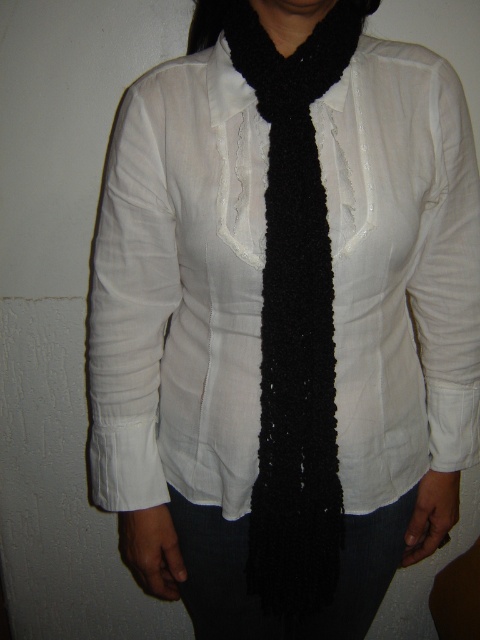
Is black knitted scarf at center closer to the viewer compared to black fuzzy scarf at center?

No.

Can you confirm if black knitted scarf at center is shorter than black fuzzy scarf at center?

No.

Between point (324, 372) and point (250, 0), which one is positioned behind?

The point (250, 0) is behind.

Identify the location of black knitted scarf at center. (x=295, y=317).

Is white cotton blouse at center thinner than black knitted scarf at center?

Incorrect, white cotton blouse at center's width is not less than black knitted scarf at center's.

Can you confirm if white cotton blouse at center is positioned below black knitted scarf at center?

No.

Does point (160, 332) come closer to viewer compared to point (278, 502)?

No, it is not.

You are a GUI agent. You are given a task and a screenshot of the screen. Output one action in this format:
    pyautogui.click(x=<x>, y=<y>)
    Task: Click on the white cotton blouse at center
    The image size is (480, 640).
    Given the screenshot: What is the action you would take?
    click(x=180, y=291)

Find the location of a particular element. The width and height of the screenshot is (480, 640). white cotton blouse at center is located at coordinates (180, 291).

Is point (424, 172) farther from viewer compared to point (264, 24)?

Yes.

Measure the distance between white cotton blouse at center and camera.

They are 29.54 inches apart.

This screenshot has width=480, height=640. What are the coordinates of `white cotton blouse at center` in the screenshot? It's located at (180, 291).